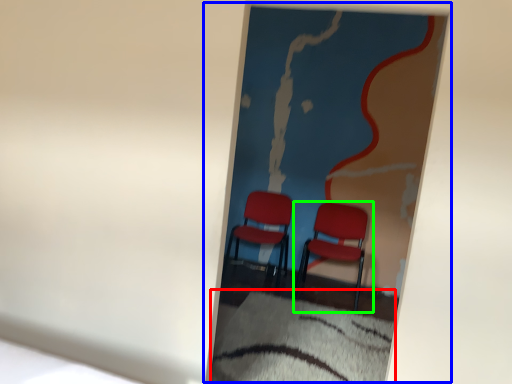
Question: Estimate the real-world distances between objects in this image. Which object is closer to sheet (highlighted by a red box), picture frame (highlighted by a blue box) or chair (highlighted by a green box)?

Choices:
 (A) picture frame
 (B) chair

Answer: (A)